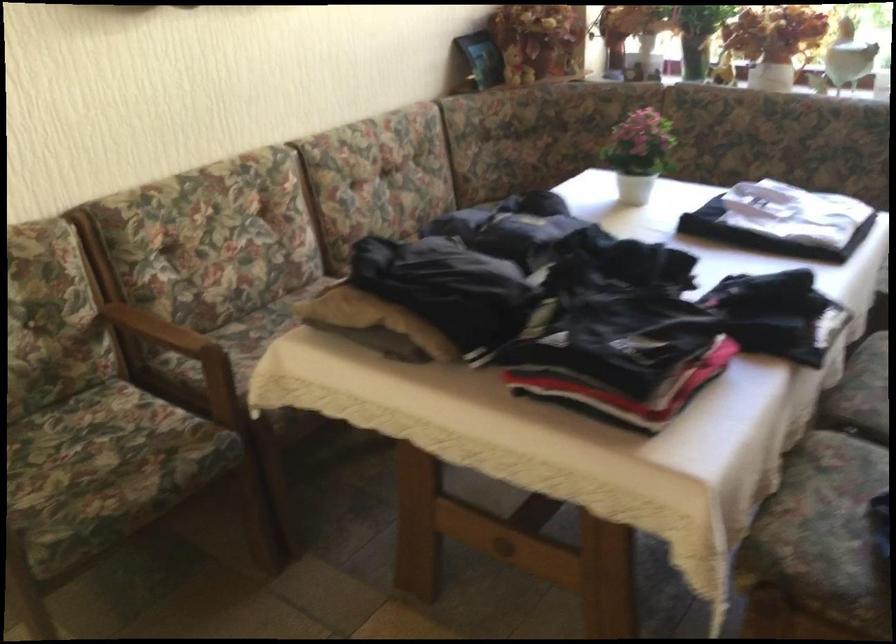
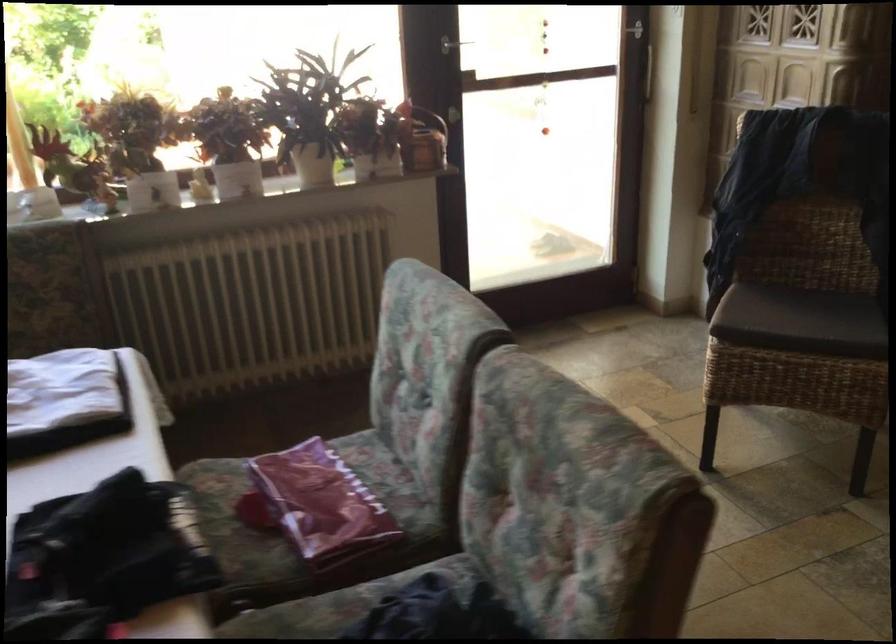
Question: The images are taken continuously from a first-person perspective. In which direction is your viewpoint rotating?

Choices:
 (A) Left
 (B) Right
 (C) Up
 (D) Down

Answer: (B)